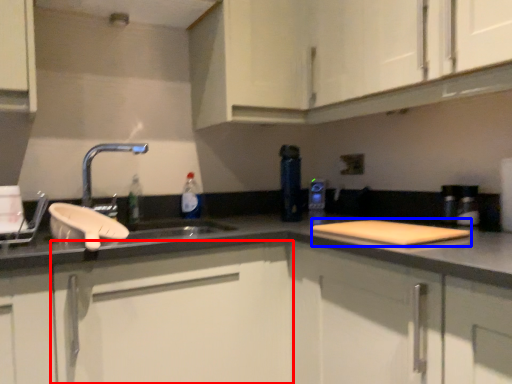
Question: Which of the following is the farthest to the observer, cabinetry (highlighted by a red box) or cutting board (highlighted by a blue box)?

Choices:
 (A) cabinetry
 (B) cutting board

Answer: (B)